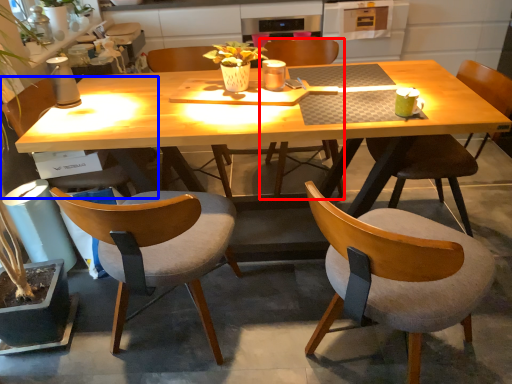
Question: Which object appears farthest to the camera in this image, chair (highlighted by a red box) or chair (highlighted by a blue box)?

Choices:
 (A) chair
 (B) chair

Answer: (A)